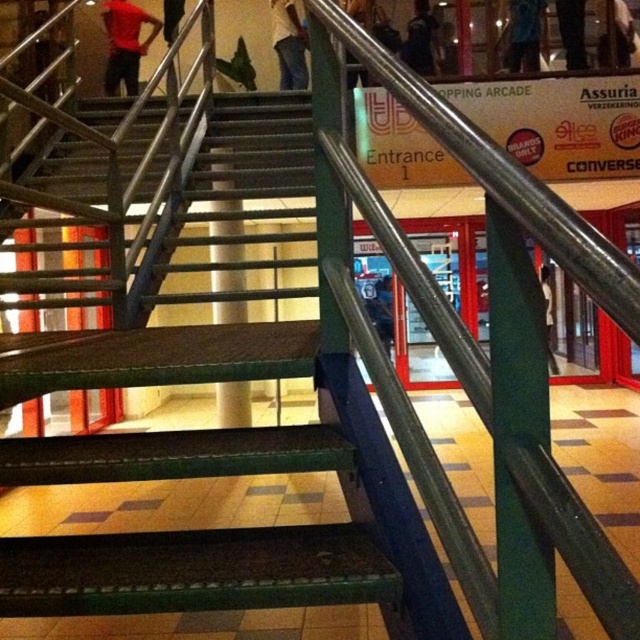
Based on the photo, does jeans at upper center have a larger size compared to dark blue backpack at upper center?

Indeed, jeans at upper center has a larger size compared to dark blue backpack at upper center.

Is point (276, 38) positioned after point (422, 4)?

Yes, it is behind point (422, 4).

Which is in front, point (282, 8) or point (432, 42)?

Point (432, 42) is in front.

I want to click on jeans at upper center, so [x=289, y=44].

Can you confirm if green metal stair at center is shorter than jeans at upper center?

Incorrect, green metal stair at center's height does not fall short of jeans at upper center's.

Is point (228, 243) less distant than point (276, 38)?

Yes.

Does point (214, 180) lie behind point (294, 22)?

No.

This screenshot has height=640, width=640. I want to click on green metal stair at center, so click(x=234, y=403).

Can you confirm if green metal stair at center is bigger than red matte shirt at upper left?

Correct, green metal stair at center is larger in size than red matte shirt at upper left.

Does green metal stair at center lie in front of red matte shirt at upper left?

Yes, green metal stair at center is closer to the viewer.

Between point (220, 205) and point (129, 96), which one is positioned behind?

The point (129, 96) is more distant.

At what (x,y) coordinates should I click in order to perform the action: click on green metal stair at center. Please return your answer as a coordinate pair (x, y). The height and width of the screenshot is (640, 640). Looking at the image, I should click on (234, 403).